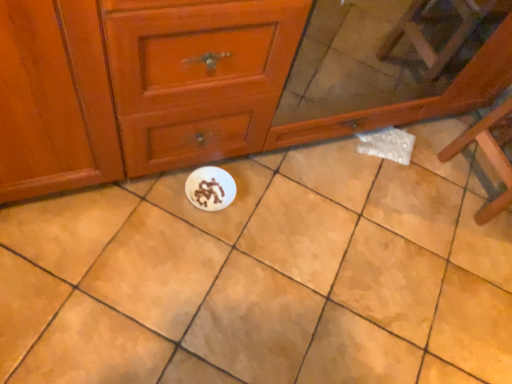
Image resolution: width=512 pixels, height=384 pixels. Identify the location of free spot to the right of white matte paper plate at center. (263, 218).